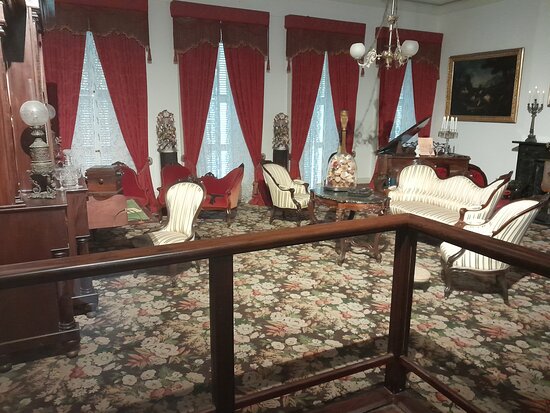
Where is `glass`? The height and width of the screenshot is (413, 550). glass is located at coordinates (157, 371), (284, 338), (456, 329).